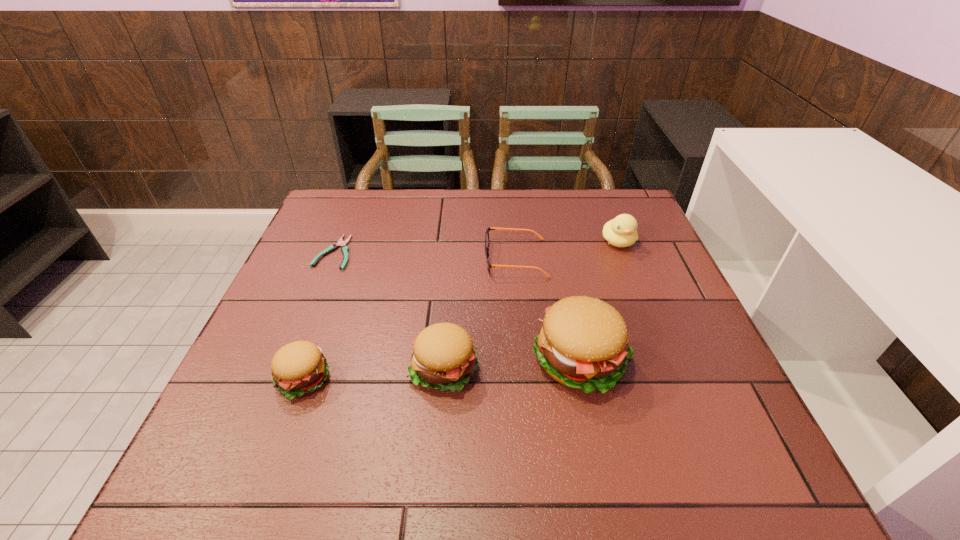
At what (x,y) coordinates should I click in order to perform the action: click on the third shortest object. Please return your answer as a coordinate pair (x, y). Image resolution: width=960 pixels, height=540 pixels. Looking at the image, I should click on (298, 368).

The height and width of the screenshot is (540, 960). I want to click on the leftmost hamburger, so click(298, 368).

This screenshot has width=960, height=540. Identify the location of the second tallest hamburger. (443, 357).

The width and height of the screenshot is (960, 540). Find the location of `the fourth object from right to left`. the fourth object from right to left is located at coordinates (443, 357).

Locate an element on the screen. The image size is (960, 540). the rightmost hamburger is located at coordinates (583, 344).

The width and height of the screenshot is (960, 540). Find the location of `the tallest hamburger`. the tallest hamburger is located at coordinates (583, 344).

Locate an element on the screen. the rightmost object is located at coordinates (621, 231).

The image size is (960, 540). I want to click on the second shortest object, so click(486, 246).

Where is `the shortest object`? The height and width of the screenshot is (540, 960). the shortest object is located at coordinates [x=344, y=248].

Identify the location of vacant space located on the right of the third shortest object. The width and height of the screenshot is (960, 540). (444, 379).